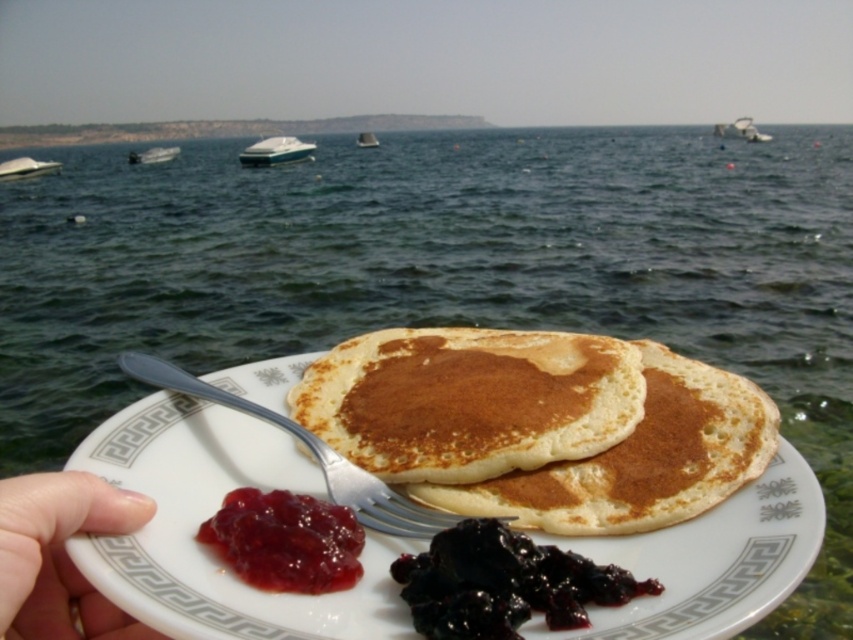
You are a photographer trying to capture both the white glossy boat at center and the white plastic boat at left in a single shot. Based on their positions, which boat should you focus on first if you want to ensure both are in frame?

The white glossy boat at center is positioned on the right side of white plastic boat at left, so you should focus on the white plastic boat at left first to ensure both are in frame.